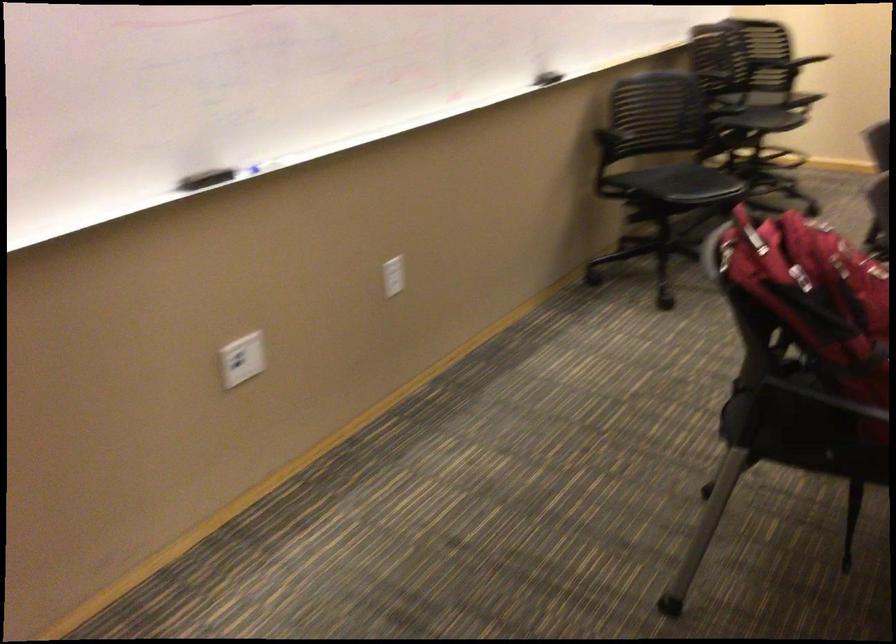
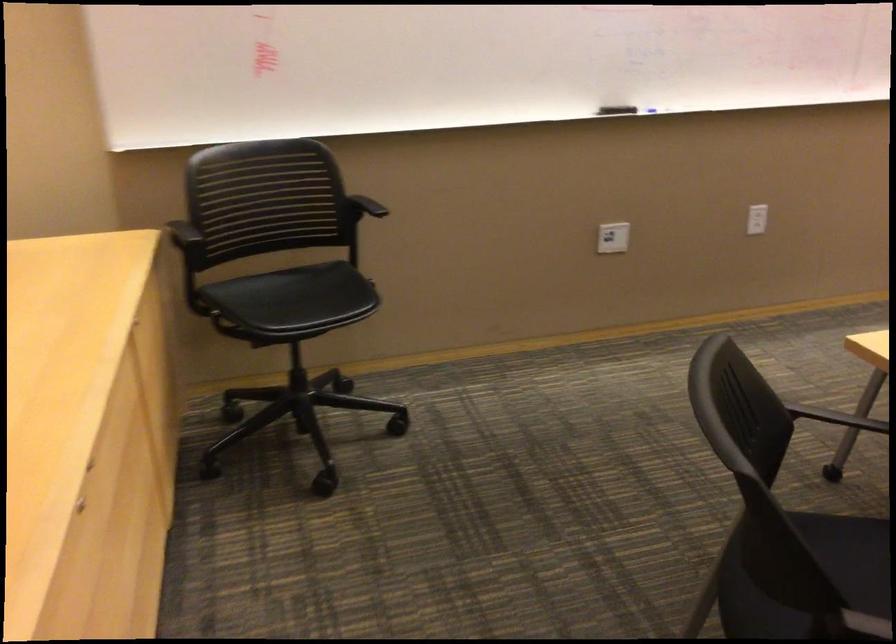
Find the pixel in the second image that matches pixel 202 185 in the first image.

(616, 109)